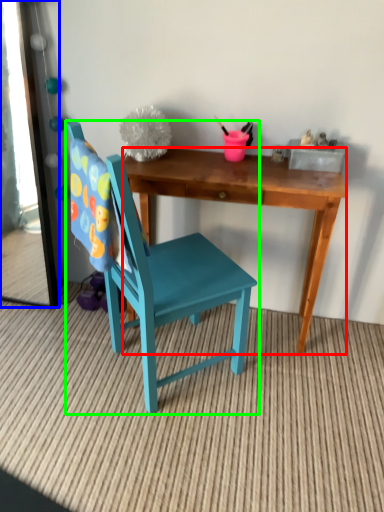
Question: Considering the real-world distances, which object is closest to desk (highlighted by a red box)? mirror (highlighted by a blue box) or chair (highlighted by a green box).

Choices:
 (A) mirror
 (B) chair

Answer: (B)